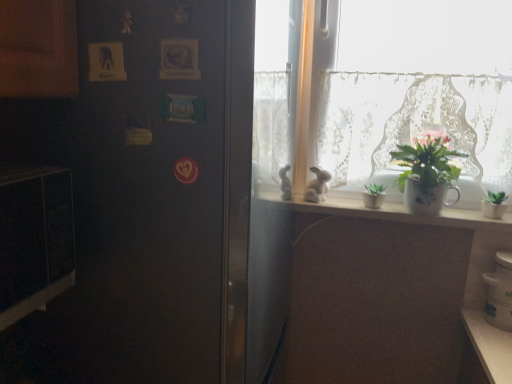
Question: In terms of width, does satin black refrigerator at left look wider or thinner when compared to white glossy jar at lower right?

Choices:
 (A) thin
 (B) wide

Answer: (B)

Question: In the image, is satin black refrigerator at left on the left side or the right side of white glossy jar at lower right?

Choices:
 (A) left
 (B) right

Answer: (A)

Question: Based on their relative distances, which object is farther from the white lace curtain at upper right?

Choices:
 (A) white matte rabbit at window
 (B) white wooden shelf at upper center
 (C) black matte microwave at left
 (D) white glossy jar at lower right
 (E) green matte plant at right

Answer: (C)

Question: Based on their relative distances, which object is farther from the green matte plant at right?

Choices:
 (A) white wooden shelf at upper center
 (B) black matte microwave at left
 (C) white lace curtain at upper right
 (D) white matte rabbit at window
 (E) satin black refrigerator at left

Answer: (B)